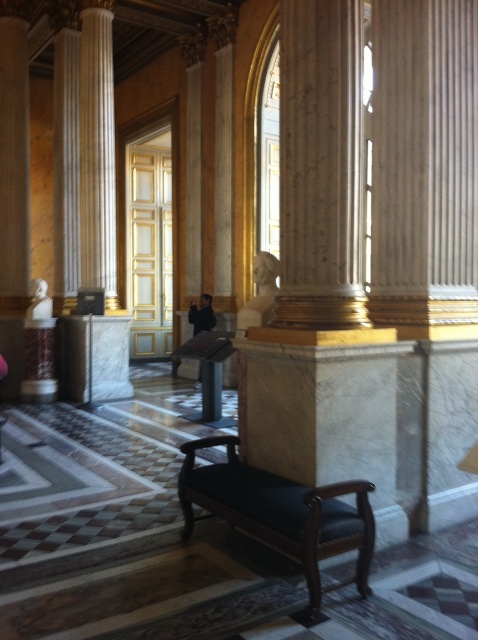
Question: Among these objects, which one is farthest from the camera?

Choices:
 (A) marble column at left
 (B) white marble bust at left

Answer: (B)

Question: In this image, where is marble column at left located relative to white marble bust at left?

Choices:
 (A) left
 (B) right

Answer: (B)

Question: Which point is closer to the camera taking this photo?

Choices:
 (A) coord(46,314)
 (B) coord(265,529)

Answer: (B)

Question: Estimate the real-world distances between objects in this image. Which object is closer to the white marble bust at left?

Choices:
 (A) dark wood bench at center
 (B) marble column at left

Answer: (B)

Question: Can you confirm if marble column at left is bigger than white marble bust at left?

Choices:
 (A) no
 (B) yes

Answer: (B)

Question: Can you confirm if dark wood bench at center is wider than white marble bust at left?

Choices:
 (A) yes
 (B) no

Answer: (A)